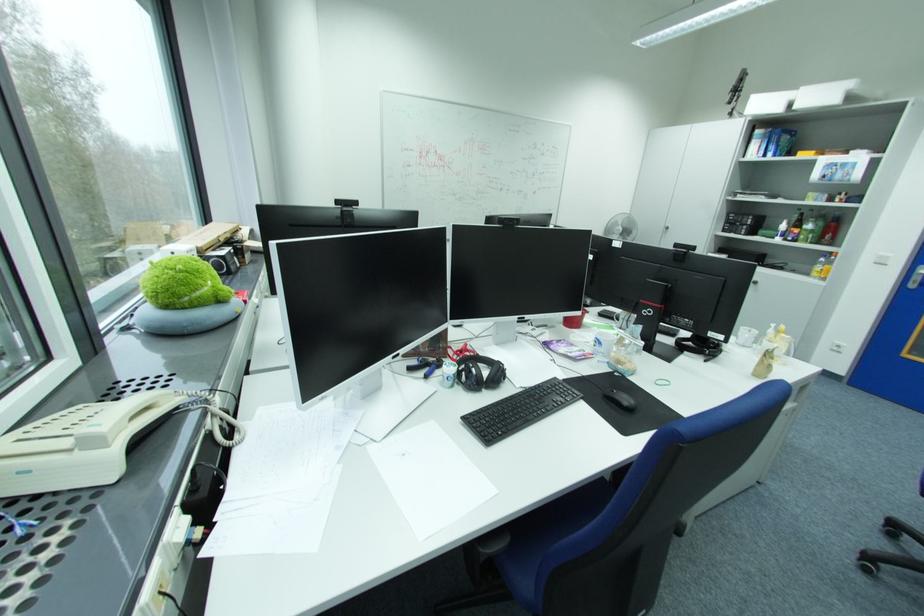
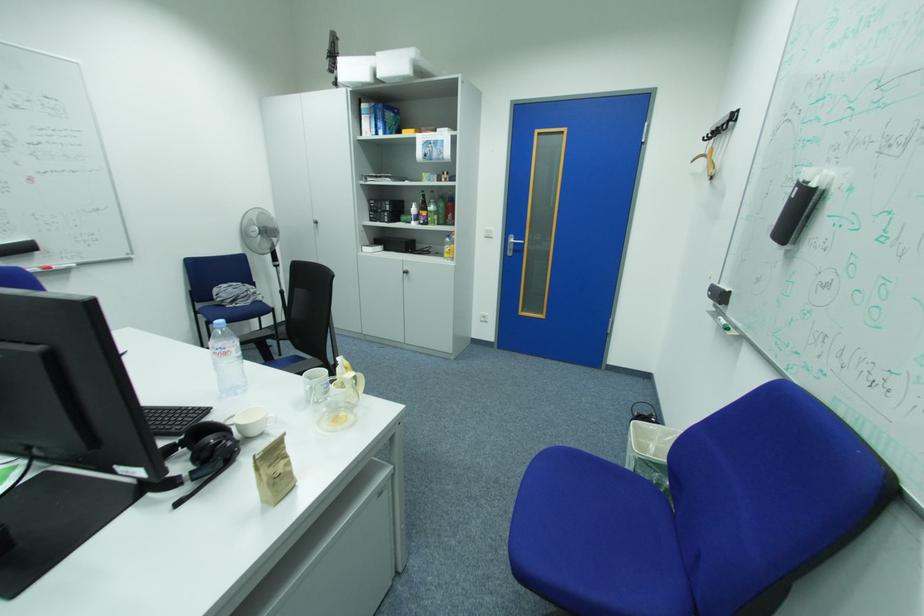
Find the pixel in the second image that matches pixel 542 174 in the first image.

(14, 140)